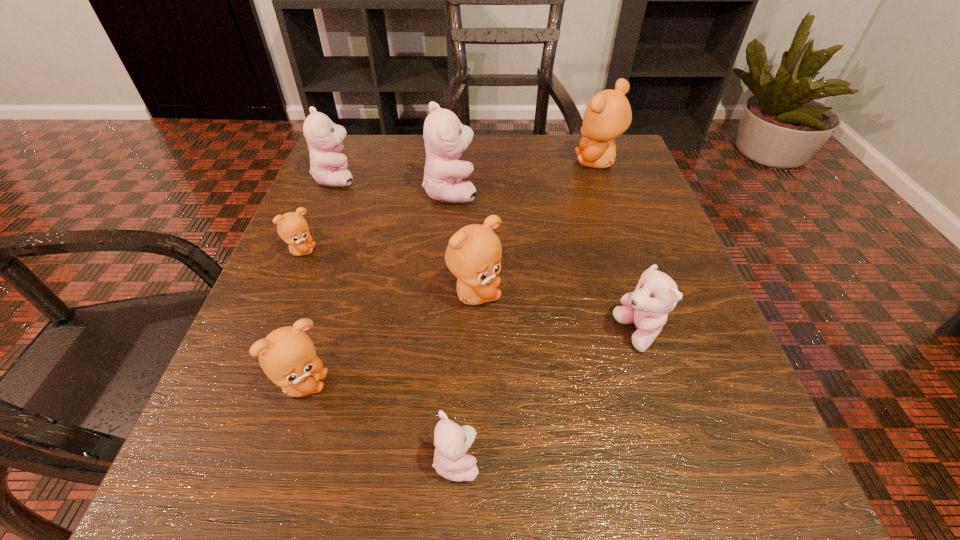
Where is `the smallest brown teddy bear`? Image resolution: width=960 pixels, height=540 pixels. the smallest brown teddy bear is located at coordinates (292, 227).

You are a GUI agent. You are given a task and a screenshot of the screen. Output one action in this format:
    pyautogui.click(x=<x>, y=<y>)
    Task: Click on the fourth farthest object
    Image resolution: width=960 pixels, height=540 pixels.
    Given the screenshot: What is the action you would take?
    pyautogui.click(x=292, y=227)

The width and height of the screenshot is (960, 540). I want to click on the nearest pink teddy bear, so click(452, 441).

Locate an element on the screen. This screenshot has width=960, height=540. the smallest pink teddy bear is located at coordinates (452, 441).

I want to click on vacant region located 0.160m at the face of the biggest pink teddy bear, so click(x=552, y=191).

In order to click on vacant space situated on the face of the rightmost brown teddy bear in this screenshot , I will do [544, 162].

In order to click on vacant space located on the face of the rightmost brown teddy bear in this screenshot , I will do `click(434, 162)`.

At what (x,y) coordinates should I click in order to perform the action: click on vacant space located 0.140m on the face of the rightmost brown teddy bear. Please return your answer as a coordinate pair (x, y). The width and height of the screenshot is (960, 540). Looking at the image, I should click on (514, 162).

In order to click on vacant space located at the face of the leftmost pink teddy bear in this screenshot , I will do `click(486, 178)`.

Find the location of a particular element. The width and height of the screenshot is (960, 540). vacant space located 0.120m on the face of the third brown teddy bear from left to right is located at coordinates (574, 295).